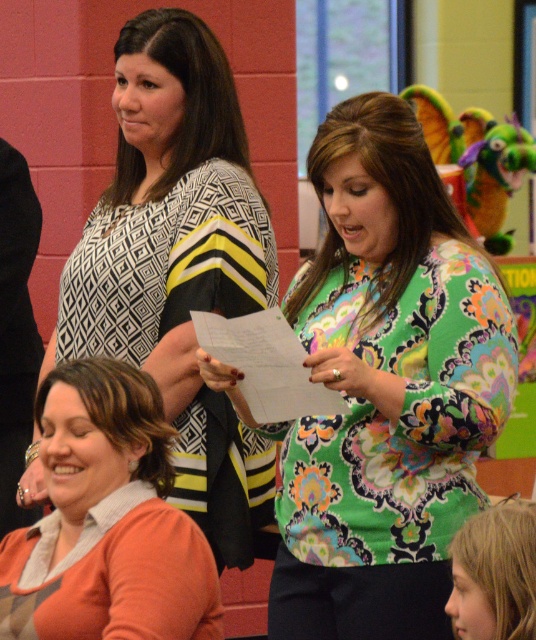
Question: Is orange soft sweater at lower left to the left of blonde hair at lower right from the viewer's perspective?

Choices:
 (A) yes
 (B) no

Answer: (A)

Question: Does patterned fabric blouse at upper center have a larger size compared to orange soft sweater at lower left?

Choices:
 (A) no
 (B) yes

Answer: (B)

Question: Which point appears closest to the camera in this image?

Choices:
 (A) (189, 524)
 (B) (63, 333)
 (C) (475, 570)

Answer: (C)

Question: Among these points, which one is nearest to the camera?

Choices:
 (A) (166, 564)
 (B) (177, 176)

Answer: (A)

Question: Can you confirm if patterned fabric blouse at upper center is smaller than orange soft sweater at lower left?

Choices:
 (A) no
 (B) yes

Answer: (A)

Question: Among these points, which one is nearest to the camera?

Choices:
 (A) (152, 113)
 (B) (185, 572)
 (C) (497, 310)

Answer: (B)